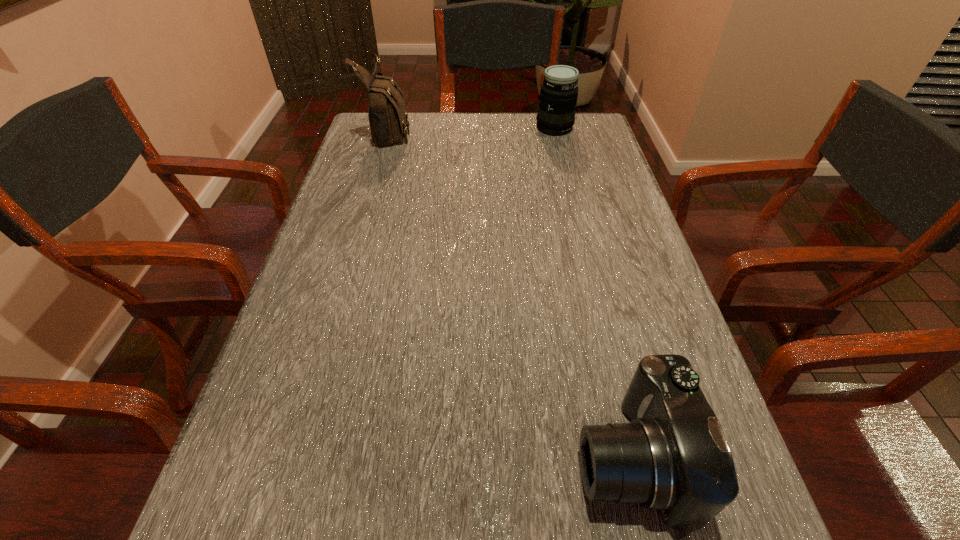
Locate an element on the screen. vacant space at the far left corner of the desktop is located at coordinates (377, 151).

The image size is (960, 540). I want to click on free region at the far right corner of the desktop, so click(x=596, y=117).

Identify the location of free point between the camera and the leftmost object. (510, 294).

The width and height of the screenshot is (960, 540). What are the coordinates of `free point between the second shortest object and the camera` in the screenshot? It's located at (592, 293).

Image resolution: width=960 pixels, height=540 pixels. In order to click on free space between the shoulder bag and the shortest object in this screenshot , I will do `click(510, 294)`.

You are a GUI agent. You are given a task and a screenshot of the screen. Output one action in this format:
    pyautogui.click(x=<x>, y=<y>)
    Task: Click on the empty space between the leftmost object and the nearest object
    This screenshot has width=960, height=540.
    Given the screenshot: What is the action you would take?
    pyautogui.click(x=510, y=294)

Locate an element on the screen. This screenshot has height=540, width=960. free space between the second shortest object and the camera is located at coordinates (592, 293).

Where is `free space between the camera and the second tallest object`? This screenshot has width=960, height=540. free space between the camera and the second tallest object is located at coordinates (592, 293).

Where is `vacant point located between the leftmost object and the telephoto lens`? Image resolution: width=960 pixels, height=540 pixels. vacant point located between the leftmost object and the telephoto lens is located at coordinates (471, 130).

Identify the location of free space between the leftmost object and the telephoto lens. The width and height of the screenshot is (960, 540). (471, 130).